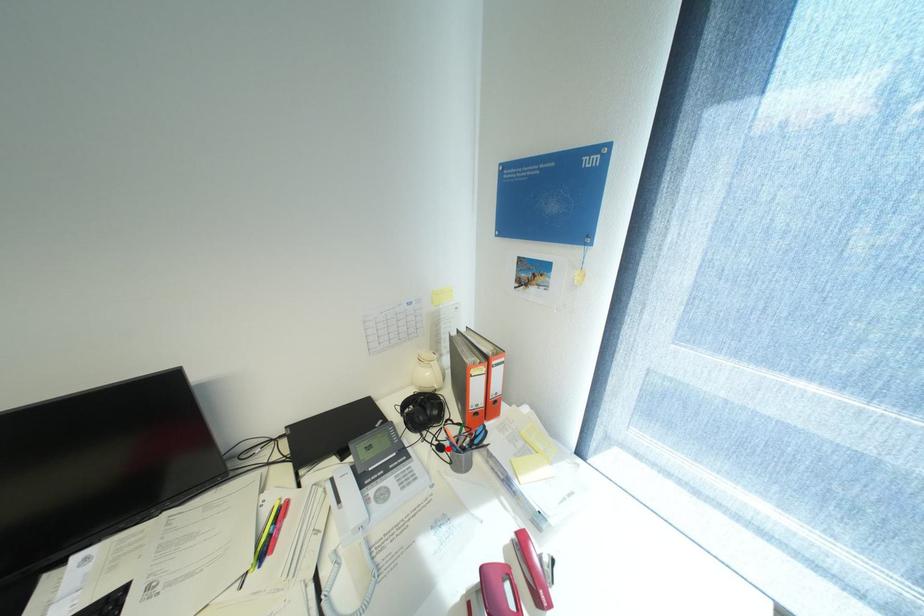
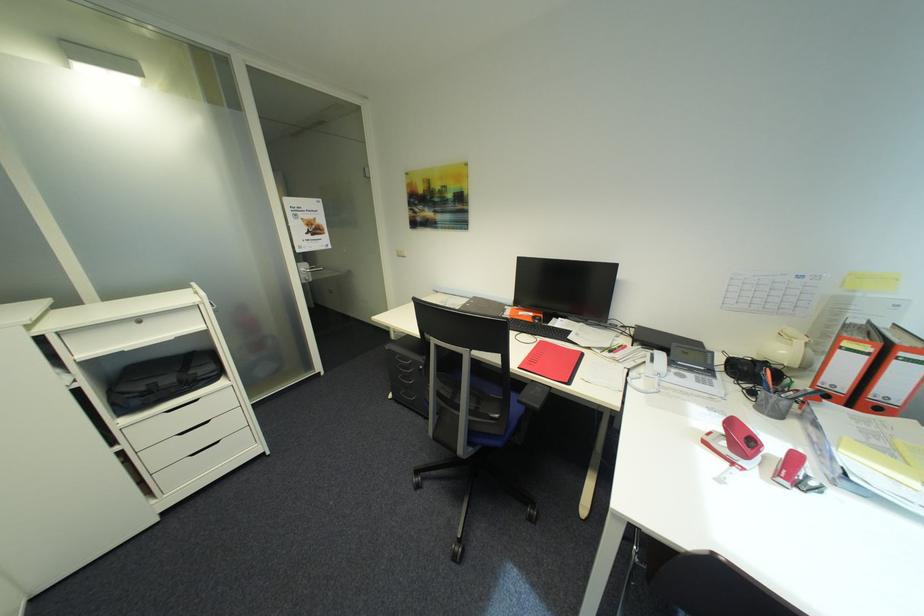
The point at the highlighted location is marked in the first image. Where is the corresponding point in the second image?

(760, 392)